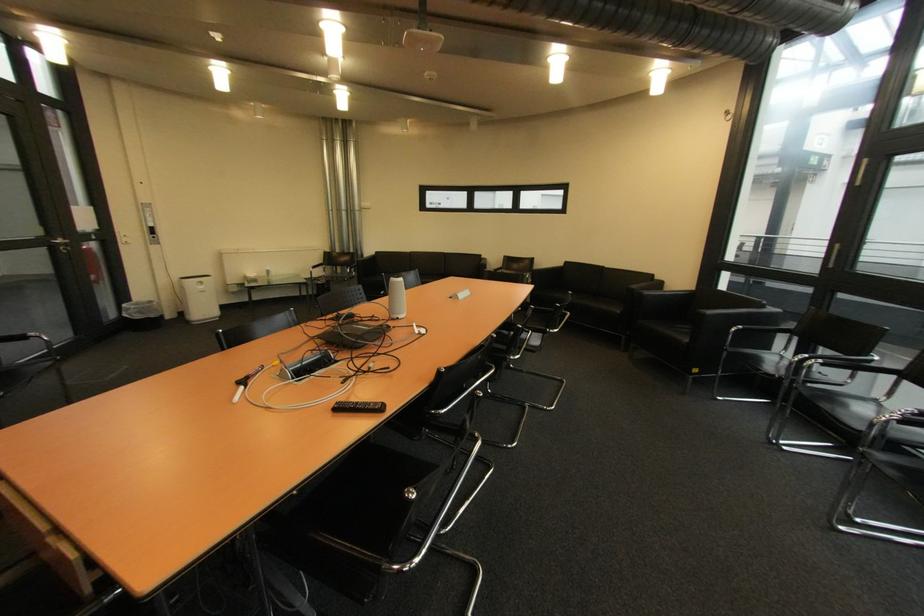
Where would you rest the sofa armrest? Please return your answer as a coordinate pair (x, y).

(744, 313)